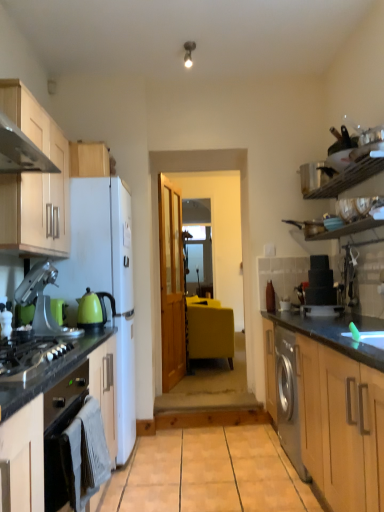
Question: Can you confirm if light wood cabinet at upper left, marked as the 2th cabinetry in a bottom-to-top arrangement, is smaller than light wood cabinet at upper left, the third cabinetry in the bottom-to-top sequence?

Choices:
 (A) yes
 (B) no

Answer: (B)

Question: Does light wood cabinet at upper left, marked as the 2th cabinetry in a bottom-to-top arrangement, have a lesser width compared to light wood cabinet at upper left, the third cabinetry in the bottom-to-top sequence?

Choices:
 (A) yes
 (B) no

Answer: (B)

Question: Is light wood cabinet at upper left, the 2th cabinetry viewed from the top, facing away from light wood cabinet at upper left, the third cabinetry in the bottom-to-top sequence?

Choices:
 (A) no
 (B) yes

Answer: (A)

Question: Is light wood cabinet at upper left, the 2th cabinetry viewed from the top, taller than light wood cabinet at upper left, positioned as the first cabinetry in top-to-bottom order?

Choices:
 (A) no
 (B) yes

Answer: (B)

Question: Considering the relative positions of light wood cabinet at upper left, the 2th cabinetry viewed from the top, and light wood cabinet at upper left, positioned as the first cabinetry in top-to-bottom order, in the image provided, is light wood cabinet at upper left, the 2th cabinetry viewed from the top, to the left of light wood cabinet at upper left, positioned as the first cabinetry in top-to-bottom order, from the viewer's perspective?

Choices:
 (A) no
 (B) yes

Answer: (B)

Question: Is light wood cabinet at upper left, the 2th cabinetry viewed from the top, to the right of light wood cabinet at upper left, the third cabinetry in the bottom-to-top sequence, from the viewer's perspective?

Choices:
 (A) yes
 (B) no

Answer: (B)

Question: Is metallic silver pot at upper right, which ranks as the 2th appliance in bottom-to-top order, facing away from green glossy kettle at left?

Choices:
 (A) yes
 (B) no

Answer: (B)

Question: Is metallic silver pot at upper right, which is the first appliance in top-to-bottom order, smaller than green glossy kettle at left?

Choices:
 (A) yes
 (B) no

Answer: (B)

Question: From a real-world perspective, is metallic silver pot at upper right, which is the first appliance in top-to-bottom order, on top of green glossy kettle at left?

Choices:
 (A) yes
 (B) no

Answer: (A)

Question: From the image's perspective, is metallic silver pot at upper right, which ranks as the 2th appliance in bottom-to-top order, on top of green glossy kettle at left?

Choices:
 (A) yes
 (B) no

Answer: (A)

Question: Is metallic silver pot at upper right, which is the first appliance in top-to-bottom order, at the right side of green glossy kettle at left?

Choices:
 (A) no
 (B) yes

Answer: (B)

Question: Considering the relative sizes of metallic silver pot at upper right, which ranks as the 2th appliance in bottom-to-top order, and green glossy kettle at left in the image provided, is metallic silver pot at upper right, which ranks as the 2th appliance in bottom-to-top order, thinner than green glossy kettle at left?

Choices:
 (A) yes
 (B) no

Answer: (A)

Question: Is the position of black granite countertop at right more distant than that of white glossy plate at right, the first appliance in the bottom-to-top sequence?

Choices:
 (A) yes
 (B) no

Answer: (B)